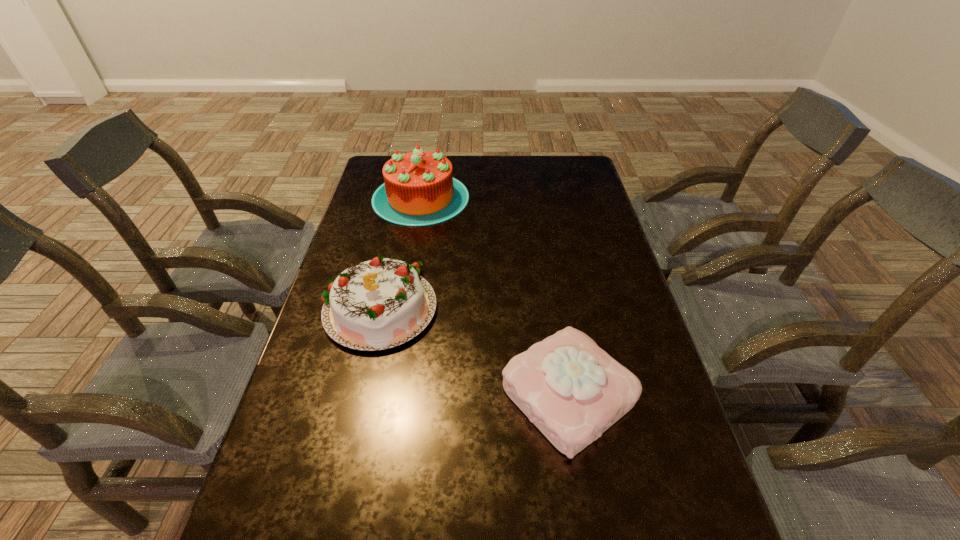
At what (x,y) coordinates should I click in order to perform the action: click on the farthest cake. Please return your answer as a coordinate pair (x, y). Image resolution: width=960 pixels, height=540 pixels. Looking at the image, I should click on (419, 189).

You are a GUI agent. You are given a task and a screenshot of the screen. Output one action in this format:
    pyautogui.click(x=<x>, y=<y>)
    Task: Click on the rightmost object
    This screenshot has width=960, height=540.
    Given the screenshot: What is the action you would take?
    pyautogui.click(x=572, y=390)

The width and height of the screenshot is (960, 540). I want to click on the rightmost cake, so click(572, 390).

The width and height of the screenshot is (960, 540). I want to click on free region located on the right of the farthest cake, so click(575, 198).

Identify the location of free space located 0.070m on the front of the shortest cake. (585, 499).

Locate an element on the screen. The height and width of the screenshot is (540, 960). object at the far edge is located at coordinates (419, 189).

Locate an element on the screen. The height and width of the screenshot is (540, 960). object located in the right edge section of the desktop is located at coordinates (572, 390).

The image size is (960, 540). In order to click on object that is at the far left corner in this screenshot , I will do `click(419, 189)`.

Find the location of a particular element. vacant region at the far edge of the desktop is located at coordinates (479, 181).

In the image, there is a desktop. Identify the location of vacant space at the left edge. (290, 463).